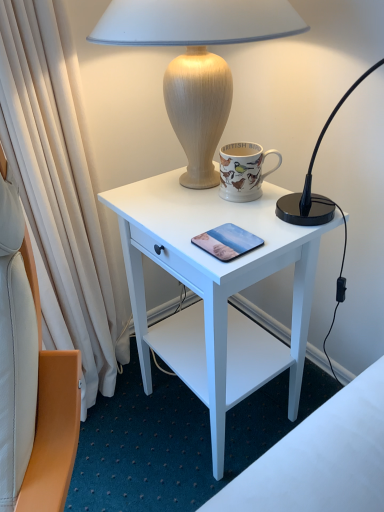
This screenshot has width=384, height=512. I want to click on free spot in front of porcelain mug with colorful birds at upper center, so click(270, 221).